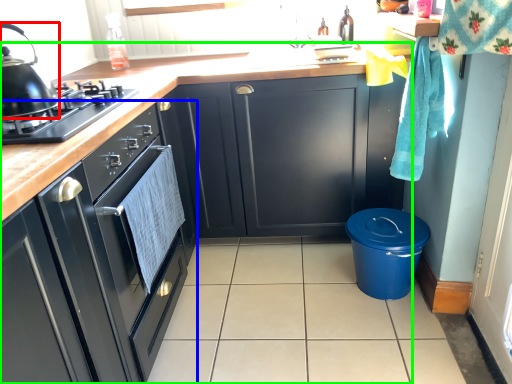
Question: Which object is positioned closest to kitchen appliance (highlighted by a red box)? Select from cabinetry (highlighted by a blue box) and cabinetry (highlighted by a green box).

Choices:
 (A) cabinetry
 (B) cabinetry

Answer: (A)